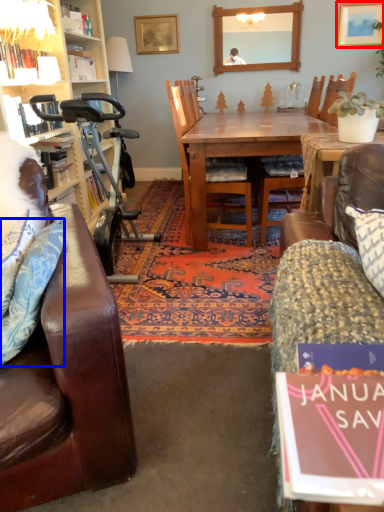
Question: Which of the following is the farthest to the observer, picture frame (highlighted by a red box) or pillow (highlighted by a blue box)?

Choices:
 (A) picture frame
 (B) pillow

Answer: (A)